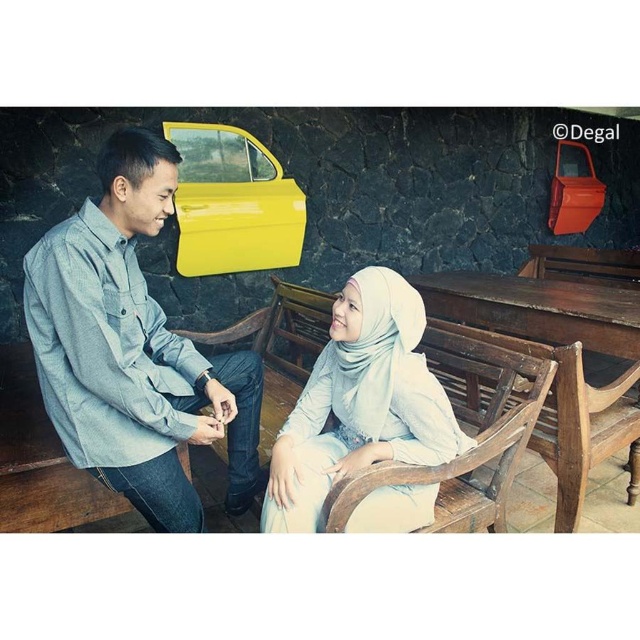
Is point (168, 500) positioned after point (412, 362)?

No, (168, 500) is closer to viewer.

Who is positioned more to the left, light gray denim shirt at left or light blue fabric hijab at center?

From the viewer's perspective, light gray denim shirt at left appears more on the left side.

This screenshot has height=640, width=640. What do you see at coordinates (132, 349) in the screenshot? I see `light gray denim shirt at left` at bounding box center [132, 349].

Locate an element on the screen. This screenshot has height=640, width=640. light gray denim shirt at left is located at coordinates (132, 349).

Is light blue fabric hijab at center to the left of yellow matte car door at upper center from the viewer's perspective?

In fact, light blue fabric hijab at center is to the right of yellow matte car door at upper center.

Consider the image. Which is below, light blue fabric hijab at center or yellow matte car door at upper center?

light blue fabric hijab at center is lower down.

Which is behind, point (275, 464) or point (275, 211)?

The point (275, 211) is behind.

Where is `light blue fabric hijab at center`? The image size is (640, 640). light blue fabric hijab at center is located at coordinates (360, 403).

Does light gray denim shirt at left appear under yellow matte car door at upper center?

Correct, light gray denim shirt at left is located below yellow matte car door at upper center.

Is point (148, 417) farther from viewer compared to point (180, 122)?

No, (148, 417) is closer to viewer.

The height and width of the screenshot is (640, 640). I want to click on light gray denim shirt at left, so click(x=132, y=349).